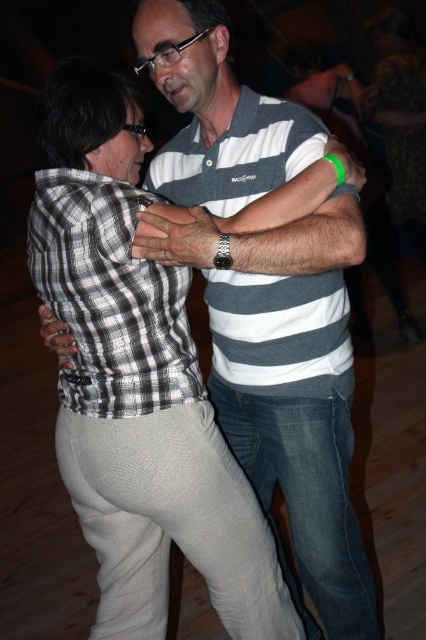
You are standing in the room where the dance is happening. You see two points marked in the image. The first point is at coordinates point (298,394) and the second point is at point (149,332). Which point is closer to you?

Point (298,394) is closer to you because it is further to the viewer than point (149,332).

Based on the photo, you are at a social event and want to take a photo of both the gray striped polo shirt at center and the checkered fabric shirt at center. Which one should you focus on first to ensure both are in focus?

You should focus on the gray striped polo shirt at center first since it is closer to the viewer than the checkered fabric shirt at center, allowing the camera to adjust depth of field to include both.

You are a photographer standing at the edge of the dance floor with your camera. You want to capture a clear photo of the gray striped polo shirt at center. What is the minimum distance you need to move forward to ensure the camera can focus on the shirt?

The gray striped polo shirt at center and the camera are 1.33 meters apart. To ensure the camera can focus, you need to move forward so that the distance is within the camera focus range. However, without knowing the camera focus range, it is impossible to determine the exact distance to move. Please provide the camera focus range for accurate advice.